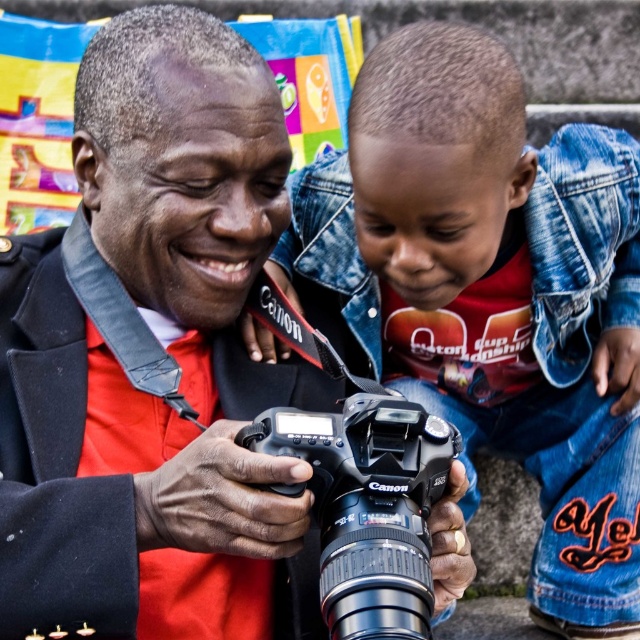
Question: From the image, what is the correct spatial relationship of black matte camera at center in relation to denim jacket at center?

Choices:
 (A) left
 (B) right

Answer: (A)

Question: Which object appears closest to the camera in this image?

Choices:
 (A) black plastic camera at center
 (B) denim jacket at center

Answer: (A)

Question: Which of the following is the farthest from the observer?

Choices:
 (A) black plastic camera at center
 (B) denim jacket at center

Answer: (B)

Question: Can you confirm if black matte camera at center is positioned below black plastic camera at center?

Choices:
 (A) yes
 (B) no

Answer: (B)

Question: Which is nearer to the denim jacket at center?

Choices:
 (A) black matte camera at center
 (B) black plastic camera at center

Answer: (A)

Question: Can you confirm if black matte camera at center is thinner than denim jacket at center?

Choices:
 (A) no
 (B) yes

Answer: (B)